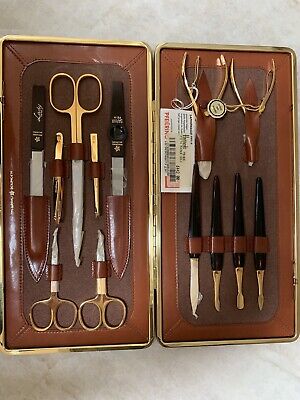
The height and width of the screenshot is (400, 300). Identify the location of table. tap(114, 391), tap(211, 22).